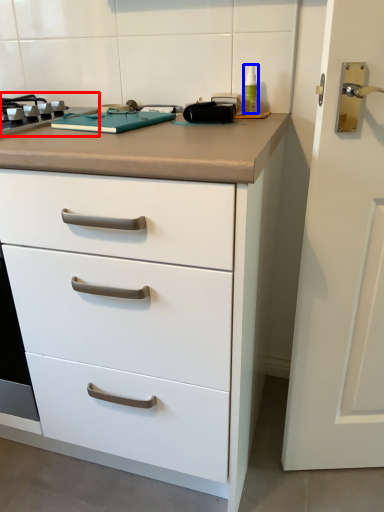
Question: Which of the following is the farthest to the observer, gas stove (highlighted by a red box) or bottle (highlighted by a blue box)?

Choices:
 (A) gas stove
 (B) bottle

Answer: (B)